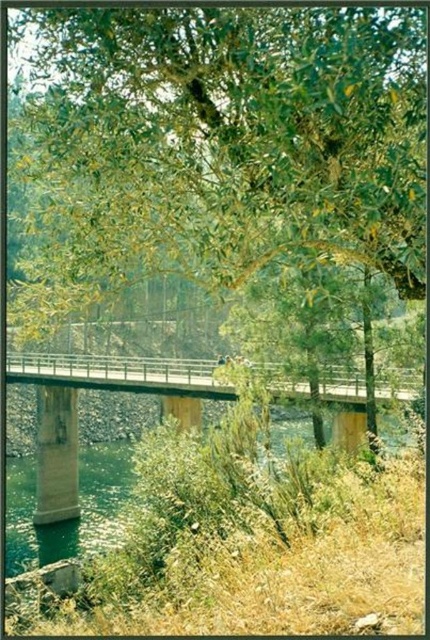
Is green leafy tree at center below metallic gray bridge at center?

Incorrect, green leafy tree at center is not positioned below metallic gray bridge at center.

Does green leafy tree at center have a greater height compared to metallic gray bridge at center?

No.

Is point (292, 67) farther from viewer compared to point (168, 369)?

That is False.

The image size is (430, 640). Identify the location of green leafy tree at center. (224, 140).